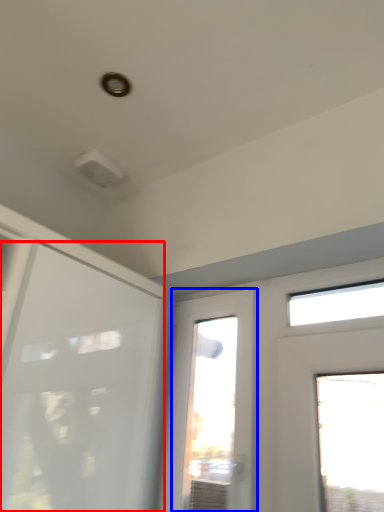
Question: Which object appears closest to the camera in this image, door (highlighted by a red box) or window (highlighted by a blue box)?

Choices:
 (A) door
 (B) window

Answer: (A)